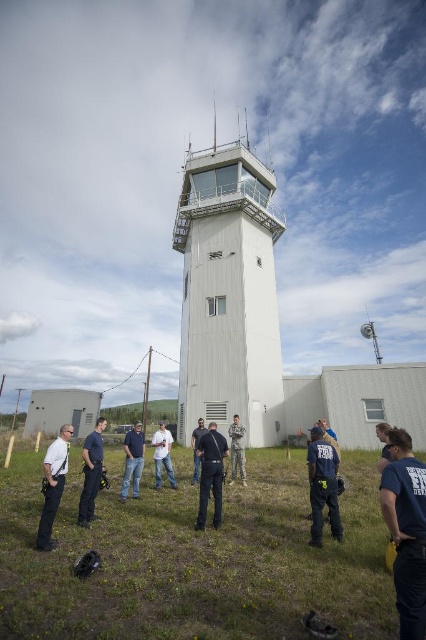
Question: Is black fabric shirt at lower right bigger than blue jeans at center?

Choices:
 (A) yes
 (B) no

Answer: (B)

Question: Among these points, which one is nearest to the camera?

Choices:
 (A) (195, 468)
 (B) (414, 554)
 (C) (313, 516)

Answer: (B)

Question: Which of these objects is positioned farthest from the white smooth control tower at center?

Choices:
 (A) camouflage uniform at center
 (B) green grass at lower center
 (C) black leather jacket at center
 (D) dark blue jeans at center

Answer: (C)

Question: Can you confirm if dark blue uniform at lower right is positioned below light blue uniform at lower left?

Choices:
 (A) no
 (B) yes

Answer: (A)

Question: Observing the image, what is the correct spatial positioning of green grass at lower center in reference to blue jeans at center?

Choices:
 (A) right
 (B) left

Answer: (A)

Question: Which point is farther from the camera taking this photo?

Choices:
 (A) (213, 333)
 (B) (310, 504)
 (C) (236, 420)
 (D) (193, 449)

Answer: (A)